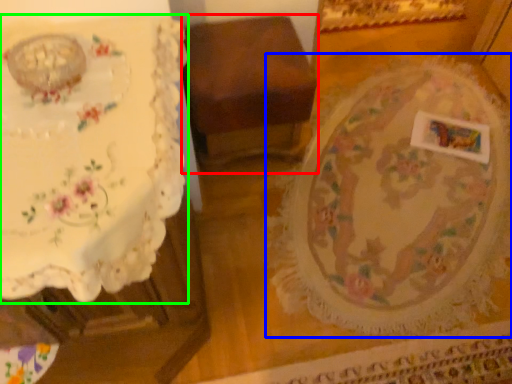
Question: Which object is the closest to the furniture (highlighted by a red box)? Choose among these: round table (highlighted by a blue box) or table (highlighted by a green box).

Choices:
 (A) round table
 (B) table

Answer: (A)